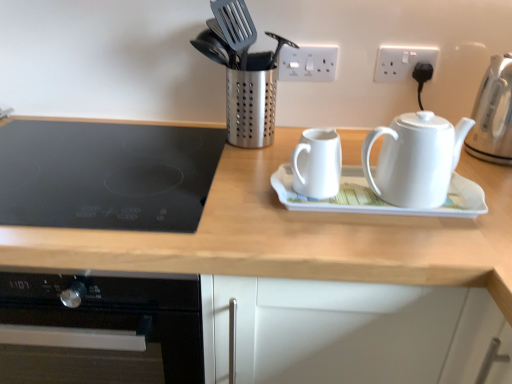
Describe the element at coordinates (106, 175) in the screenshot. I see `black glass cooktop at left` at that location.

What is the approximate width of wooden at upper center?

29.68 inches.

Identify the location of white plastic electric outlet at upper right, which is counted as the first electric outlet, starting from the right. This screenshot has height=384, width=512. (402, 62).

What do you see at coordinates (378, 198) in the screenshot? The image size is (512, 384). I see `white ceramic saucer at center` at bounding box center [378, 198].

Where is `white plastic socket at upper center, the first electric outlet in the left-to-right sequence`? The height and width of the screenshot is (384, 512). white plastic socket at upper center, the first electric outlet in the left-to-right sequence is located at coordinates (307, 63).

From the image's perspective, is white glossy teapot at right, the 2th kettle positioned from the left, on black glass cooktop at left?

Actually, white glossy teapot at right, the 2th kettle positioned from the left, appears below black glass cooktop at left in the image.

Does white glossy teapot at right, which appears as the second kettle when viewed from the right, contain black glass cooktop at left?

Definitely not — black glass cooktop at left is not inside white glossy teapot at right, which appears as the second kettle when viewed from the right.

How many degrees apart are the facing directions of white glossy teapot at right, the 2th kettle positioned from the left, and black glass cooktop at left?

3.3 degrees.

Does point (402, 148) come closer to viewer compared to point (76, 172)?

Yes, point (402, 148) is closer to viewer.

Is wooden at upper center facing towards white glossy teapot at right, the 2th kettle positioned from the left?

No, wooden at upper center is not turned towards white glossy teapot at right, the 2th kettle positioned from the left.

Is wooden at upper center positioned beyond the bounds of white glossy teapot at right, the 2th kettle positioned from the left?

Yes, wooden at upper center is not within white glossy teapot at right, the 2th kettle positioned from the left.

From the picture: Measure the distance from wooden at upper center to white glossy teapot at right, the 2th kettle positioned from the left.

wooden at upper center and white glossy teapot at right, the 2th kettle positioned from the left, are 17.06 centimeters apart from each other.

Who is taller, wooden at upper center or white glossy teapot at right, the 2th kettle positioned from the left?

wooden at upper center.

Is white glossy teapot at right, which appears as the second kettle when viewed from the right, turned away from white ceramic saucer at center?

Yes, white ceramic saucer at center is at the back of white glossy teapot at right, which appears as the second kettle when viewed from the right.

Who is bigger, white glossy teapot at right, the 2th kettle positioned from the left, or white ceramic saucer at center?

Bigger between the two is white glossy teapot at right, the 2th kettle positioned from the left.

In order to click on the 1st kettle above when counting from the white ceramic saucer at center (from the image's perspective) in this screenshot , I will do `click(415, 159)`.

From a real-world perspective, who is located lower, black glass cooktop at left or white plastic electric outlet at upper right, the 2th electric outlet when ordered from left to right?

In real-world perspective, black glass cooktop at left is lower.

Is point (143, 153) behind point (395, 61)?

Yes, it is behind point (395, 61).

Can you confirm if black glass cooktop at left is smaller than white plastic electric outlet at upper right, the 2th electric outlet when ordered from left to right?

Incorrect, black glass cooktop at left is not smaller in size than white plastic electric outlet at upper right, the 2th electric outlet when ordered from left to right.

Can you confirm if satin silver kettle at right, the 1th kettle when ordered from right to left, is taller than white glossy teapot at center, arranged as the first kettle when viewed from the left?

Indeed, satin silver kettle at right, the 1th kettle when ordered from right to left, has a greater height compared to white glossy teapot at center, arranged as the first kettle when viewed from the left.

Does satin silver kettle at right, the 1th kettle when ordered from right to left, touch white glossy teapot at center, placed as the 3th kettle when sorted from right to left?

No, satin silver kettle at right, the 1th kettle when ordered from right to left, is not making contact with white glossy teapot at center, placed as the 3th kettle when sorted from right to left.

Which object is wider, satin silver kettle at right, the 1th kettle when ordered from right to left, or white glossy teapot at center, arranged as the first kettle when viewed from the left?

satin silver kettle at right, the 1th kettle when ordered from right to left.

Is satin silver kettle at right, the 3th kettle in the left-to-right sequence, at the back of white glossy teapot at center, arranged as the first kettle when viewed from the left?

That's not correct — white glossy teapot at center, arranged as the first kettle when viewed from the left, is not looking away from satin silver kettle at right, the 3th kettle in the left-to-right sequence.

Which is closer to the camera, (311, 165) or (490, 126)?

Clearly, point (311, 165) is closer to the camera than point (490, 126).

Which is more to the right, white glossy teapot at center, placed as the 3th kettle when sorted from right to left, or satin silver kettle at right, the 1th kettle when ordered from right to left?

satin silver kettle at right, the 1th kettle when ordered from right to left, is more to the right.

Measure the distance between white plastic socket at upper center, the first electric outlet in the left-to-right sequence, and wooden at upper center.

white plastic socket at upper center, the first electric outlet in the left-to-right sequence, is 48.58 centimeters from wooden at upper center.

Considering the sizes of objects white plastic socket at upper center, the first electric outlet in the left-to-right sequence, and wooden at upper center in the image provided, who is shorter, white plastic socket at upper center, the first electric outlet in the left-to-right sequence, or wooden at upper center?

white plastic socket at upper center, the first electric outlet in the left-to-right sequence.

Is white plastic socket at upper center, which appears as the second electric outlet when viewed from the right, oriented towards wooden at upper center?

No, white plastic socket at upper center, which appears as the second electric outlet when viewed from the right, is not aimed at wooden at upper center.

From the wooden at upper center, count 2nd electric outlets backward and point to it. Please provide its 2D coordinates.

[(307, 63)]

From the image's perspective, count 2nd kettles downward from the black glass cooktop at left and point to it. Please provide its 2D coordinates.

[(415, 159)]

Locate an element on the screen. countertop on the left of the white glossy teapot at right, the 2th kettle positioned from the left is located at coordinates (295, 236).

Looking at this image, considering their positions, is satin silver kettle at right, the 3th kettle in the left-to-right sequence, positioned further to white glossy teapot at center, placed as the 3th kettle when sorted from right to left, than white glossy teapot at right, the 2th kettle positioned from the left?

Based on the image, satin silver kettle at right, the 3th kettle in the left-to-right sequence, appears to be further to white glossy teapot at center, placed as the 3th kettle when sorted from right to left.

From the image, which object appears to be farther from white ceramic saucer at center, white plastic electric outlet at upper right, which is counted as the first electric outlet, starting from the right, or black glass cooktop at left?

white plastic electric outlet at upper right, which is counted as the first electric outlet, starting from the right.

Based on their spatial positions, is white plastic socket at upper center, which appears as the second electric outlet when viewed from the right, or white plastic electric outlet at upper right, which is counted as the first electric outlet, starting from the right, further from black glass cooktop at left?

white plastic electric outlet at upper right, which is counted as the first electric outlet, starting from the right, lies further to black glass cooktop at left than the other object.

Looking at the image, which one is located further to white glossy teapot at center, arranged as the first kettle when viewed from the left, satin silver kettle at right, the 3th kettle in the left-to-right sequence, or wooden at upper center?

Answer: satin silver kettle at right, the 3th kettle in the left-to-right sequence, is positioned further to the anchor white glossy teapot at center, arranged as the first kettle when viewed from the left.

Based on their spatial positions, is white ceramic saucer at center or wooden at upper center further from white plastic socket at upper center, which appears as the second electric outlet when viewed from the right?

wooden at upper center.

When comparing their distances from white glossy teapot at center, arranged as the first kettle when viewed from the left, does black glass cooktop at left or wooden at upper center seem further?

black glass cooktop at left.

Estimate the real-world distances between objects in this image. Which object is closer to black glass cooktop at left, white glossy teapot at center, placed as the 3th kettle when sorted from right to left, or white glossy teapot at right, the 2th kettle positioned from the left?

Based on the image, white glossy teapot at center, placed as the 3th kettle when sorted from right to left, appears to be nearer to black glass cooktop at left.

Based on their spatial positions, is white glossy teapot at right, the 2th kettle positioned from the left, or white glossy teapot at center, arranged as the first kettle when viewed from the left, further from wooden at upper center?

white glossy teapot at center, arranged as the first kettle when viewed from the left.

Where is `kettle situated between white ceramic saucer at center and satin silver kettle at right, the 1th kettle when ordered from right to left, from left to right`? This screenshot has height=384, width=512. kettle situated between white ceramic saucer at center and satin silver kettle at right, the 1th kettle when ordered from right to left, from left to right is located at coordinates (415, 159).

Image resolution: width=512 pixels, height=384 pixels. I want to click on countertop between black glass cooktop at left and white plastic electric outlet at upper right, which is counted as the first electric outlet, starting from the right, in the horizontal direction, so click(x=295, y=236).

At what (x,y) coordinates should I click in order to perform the action: click on saucer between black glass cooktop at left and white plastic electric outlet at upper right, the 2th electric outlet when ordered from left to right, in the horizontal direction. Please return your answer as a coordinate pair (x, y). The height and width of the screenshot is (384, 512). Looking at the image, I should click on (378, 198).

The height and width of the screenshot is (384, 512). I want to click on saucer between white glossy teapot at center, arranged as the first kettle when viewed from the left, and satin silver kettle at right, the 3th kettle in the left-to-right sequence, from left to right, so click(x=378, y=198).